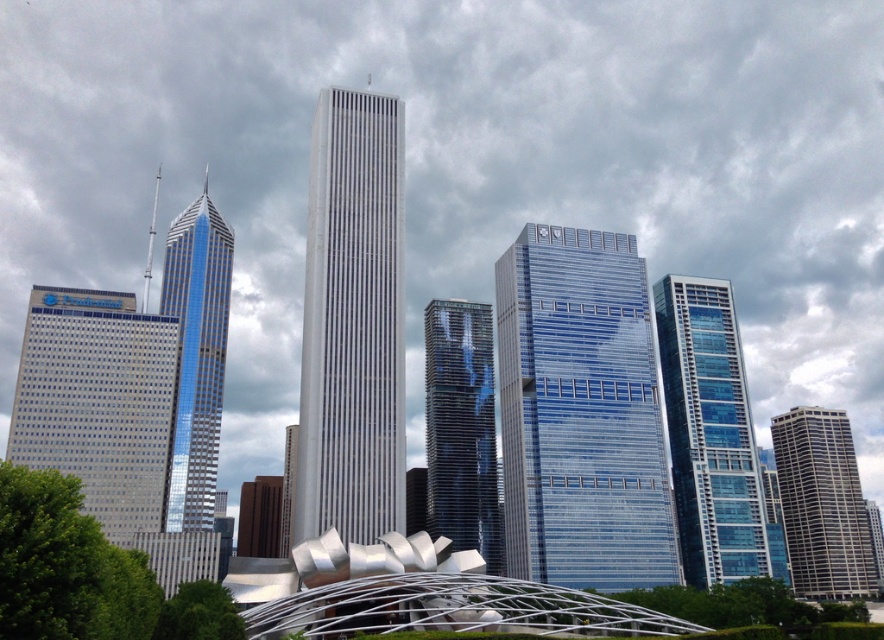
Between blue glass skyscraper at center and matte glass building at left, which one is positioned higher?

Positioned higher is matte glass building at left.

Can you confirm if blue glass skyscraper at center is thinner than matte glass building at left?

No, blue glass skyscraper at center is not thinner than matte glass building at left.

Does point (613, 548) come behind point (149, 508)?

Yes, point (613, 548) is behind point (149, 508).

Locate an element on the screen. blue glass skyscraper at center is located at coordinates (580, 413).

Which is above, reflective glass skyscraper at center or shiny glass skyscraper at left?

shiny glass skyscraper at left

Is the position of reflective glass skyscraper at center more distant than that of shiny glass skyscraper at left?

Yes, reflective glass skyscraper at center is further from the viewer.

The width and height of the screenshot is (884, 640). Find the location of `reflective glass skyscraper at center`. reflective glass skyscraper at center is located at coordinates (461, 429).

The image size is (884, 640). In order to click on reflective glass skyscraper at center in this screenshot , I will do click(461, 429).

Looking at this image, can you confirm if reflective glass skyscraper at center is positioned to the left of gray marble skyscraper at right?

Indeed, reflective glass skyscraper at center is positioned on the left side of gray marble skyscraper at right.

Which is in front, point (450, 476) or point (804, 563)?

Point (450, 476) is more forward.

At what (x,y) coordinates should I click in order to perform the action: click on reflective glass skyscraper at center. Please return your answer as a coordinate pair (x, y). The image size is (884, 640). Looking at the image, I should click on (461, 429).